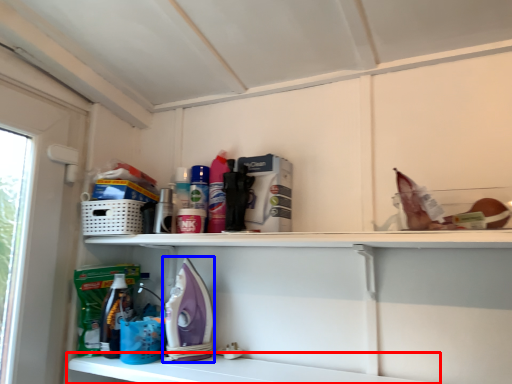
Question: Among these objects, which one is farthest to the camera, shelf (highlighted by a red box) or appliance (highlighted by a blue box)?

Choices:
 (A) shelf
 (B) appliance

Answer: (B)